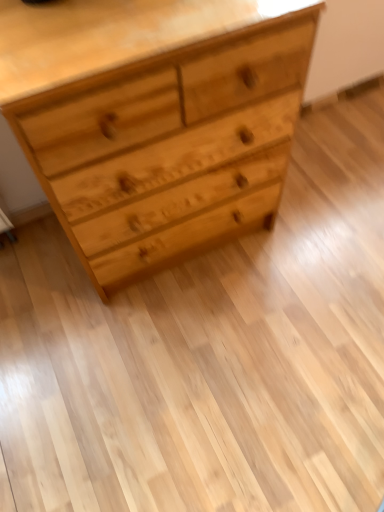
Where is `blank space situated above natural wood chest of drawers at upper center (from a real-world perspective)`? blank space situated above natural wood chest of drawers at upper center (from a real-world perspective) is located at coordinates (106, 26).